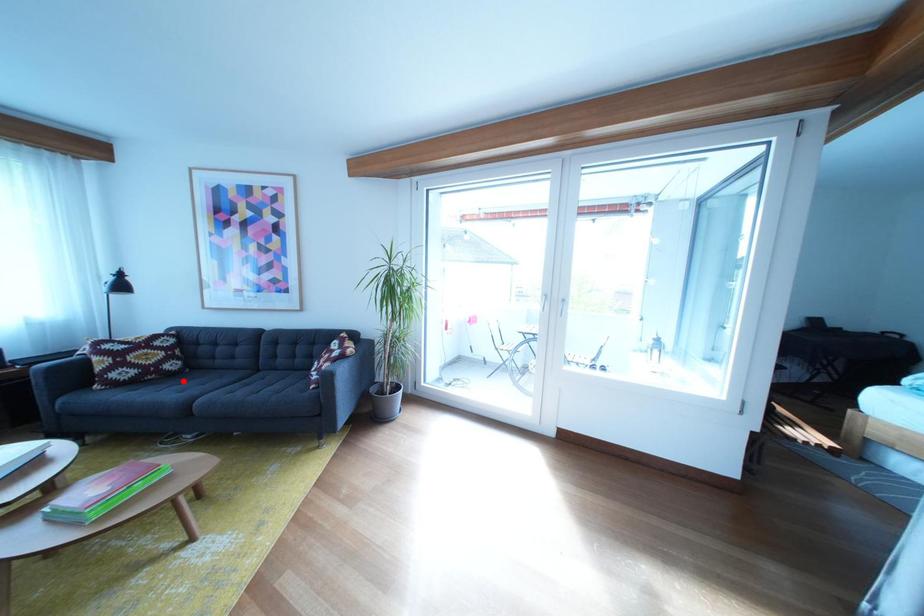
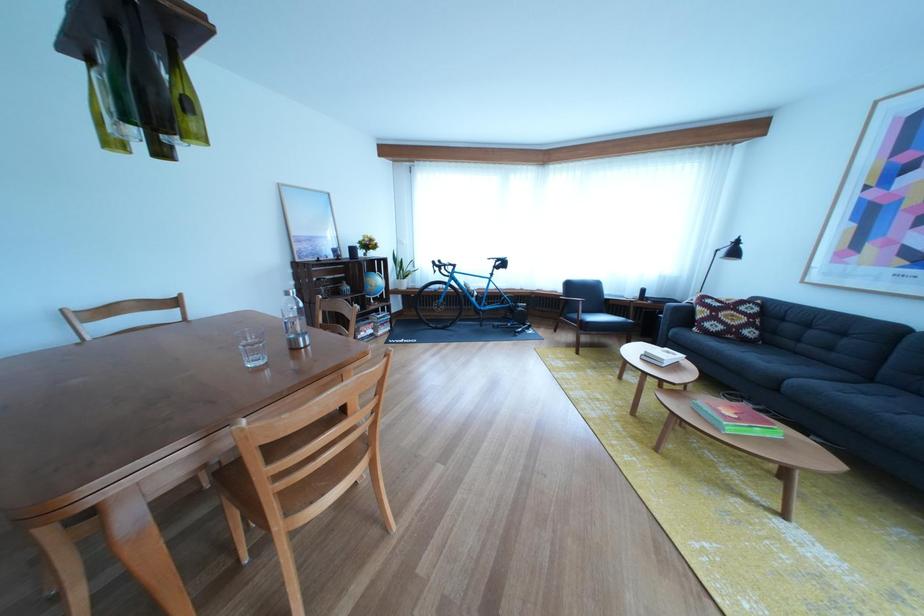
The point at the highlighted location is marked in the first image. Where is the corresponding point in the second image?

(758, 347)